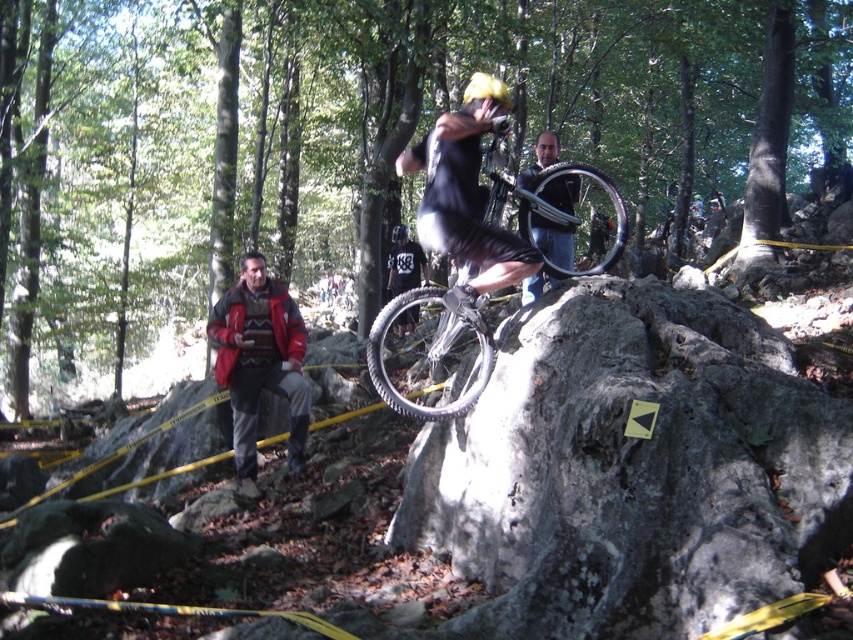
Question: Can you confirm if silver metallic bicycle at center is wider than metallic silver bicycle at center?

Choices:
 (A) yes
 (B) no

Answer: (A)

Question: Does black matte shirt at center appear over metallic silver bicycle at center?

Choices:
 (A) yes
 (B) no

Answer: (B)

Question: Among these points, which one is nearest to the camera?

Choices:
 (A) (415, 262)
 (B) (546, 262)
 (C) (532, 228)

Answer: (B)

Question: Which object is closer to the camera taking this photo?

Choices:
 (A) metallic silver bicycle at center
 (B) red jacket at left
 (C) yellow matte bicycle helmet at upper center

Answer: (A)

Question: From the image, what is the correct spatial relationship of black matte shirt at center in relation to metallic silver bicycle at center?

Choices:
 (A) right
 (B) left

Answer: (B)

Question: Which point appears farthest from the camera in this image?

Choices:
 (A) (397, 236)
 (B) (407, 259)

Answer: (A)